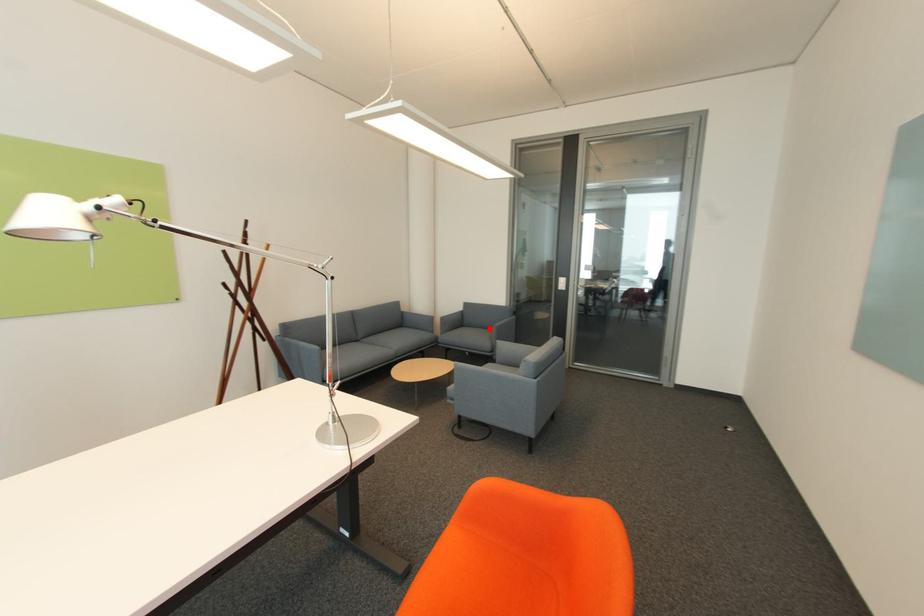
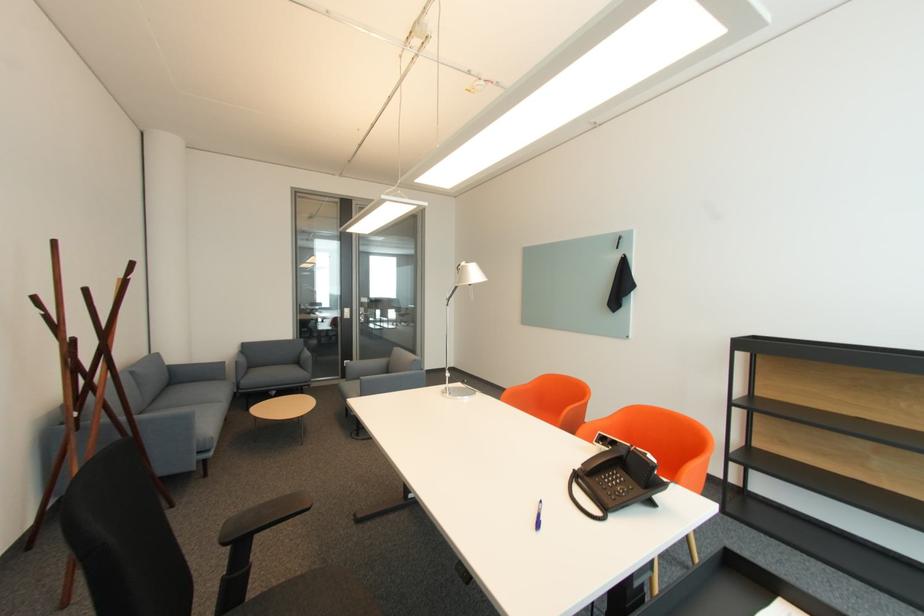
In the second image, find the point that corresponds to the highlighted location in the first image.

(282, 365)